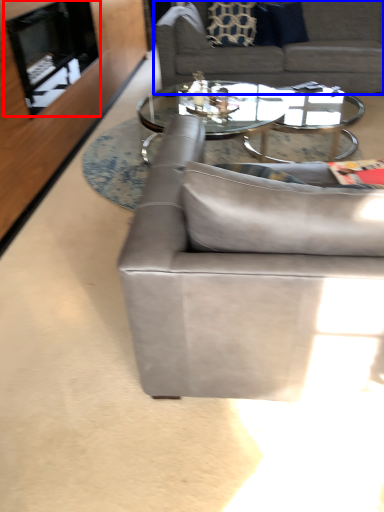
Question: Which of the following is the closest to the observer, fireplace (highlighted by a red box) or studio couch (highlighted by a blue box)?

Choices:
 (A) fireplace
 (B) studio couch

Answer: (A)